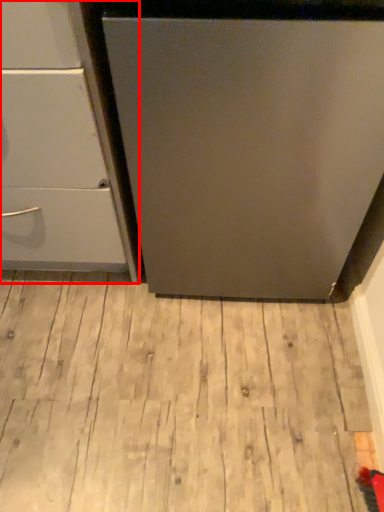
Question: From the image's perspective, where is chest of drawers (annotated by the red box) located relative to hardwood?

Choices:
 (A) above
 (B) below

Answer: (A)